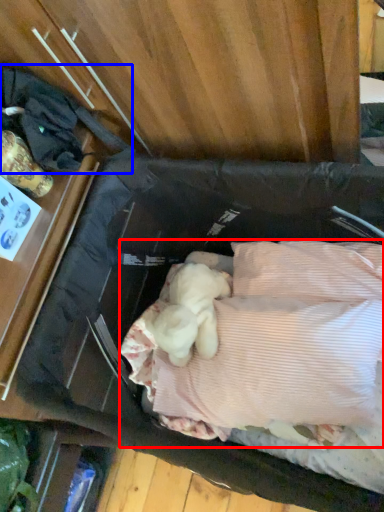
Question: Which object is closer to the camera taking this photo, wide (highlighted by a red box) or clothing (highlighted by a blue box)?

Choices:
 (A) wide
 (B) clothing

Answer: (B)